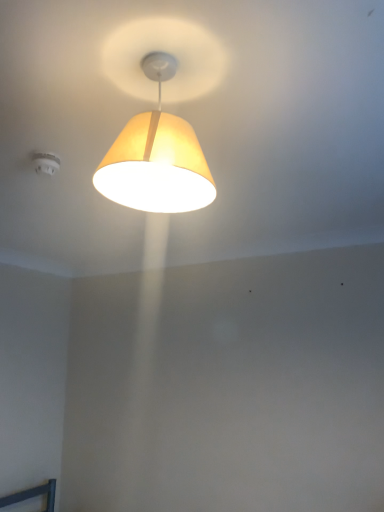
Image resolution: width=384 pixels, height=512 pixels. I want to click on matte yellow fabric lampshade at upper center, so click(156, 157).

What do you see at coordinates (156, 157) in the screenshot? I see `matte yellow fabric lampshade at upper center` at bounding box center [156, 157].

Where is `matte yellow fabric lampshade at upper center`? Image resolution: width=384 pixels, height=512 pixels. matte yellow fabric lampshade at upper center is located at coordinates (156, 157).